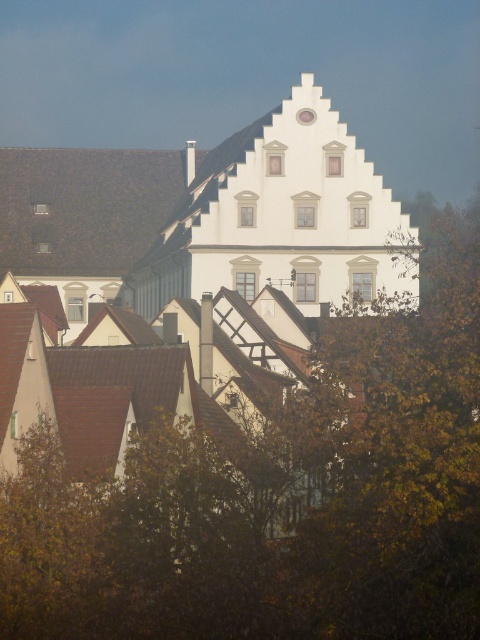
Can you confirm if brown leafy tree at upper center is taller than white glossy clock at upper center?

Yes.

Is brown leafy tree at upper center in front of white glossy clock at upper center?

Yes, brown leafy tree at upper center is in front of white glossy clock at upper center.

Based on the photo, who is more forward, (313, 461) or (303, 115)?

Point (313, 461)

At what (x,y) coordinates should I click in order to perform the action: click on brown leafy tree at upper center. Please return your answer as a coordinate pair (x, y). Looking at the image, I should click on (280, 499).